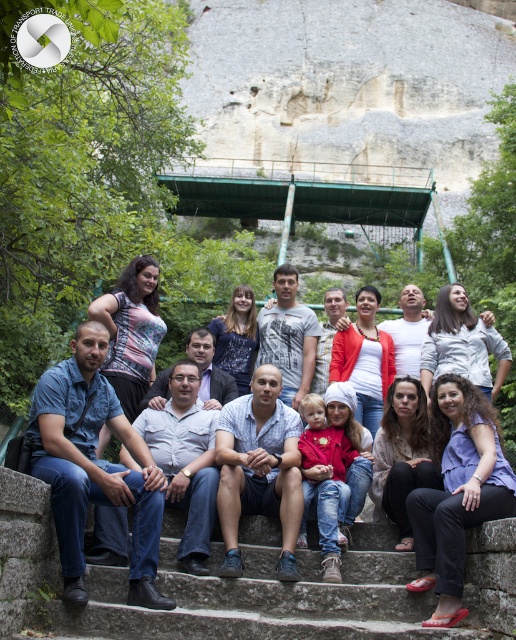
Question: Is gray concrete stairs at lower center above light blue denim jeans at center?

Choices:
 (A) yes
 (B) no

Answer: (B)

Question: Is gray concrete stairs at lower center above light blue denim jeans at center?

Choices:
 (A) yes
 (B) no

Answer: (B)

Question: Which point is closer to the camera?

Choices:
 (A) gray concrete stairs at lower center
 (B) light blue denim jeans at center

Answer: (A)

Question: Does gray concrete stairs at lower center appear under light blue denim jeans at center?

Choices:
 (A) no
 (B) yes

Answer: (B)

Question: Which of the following is the closest to the observer?

Choices:
 (A) (202, 637)
 (B) (33, 600)

Answer: (A)